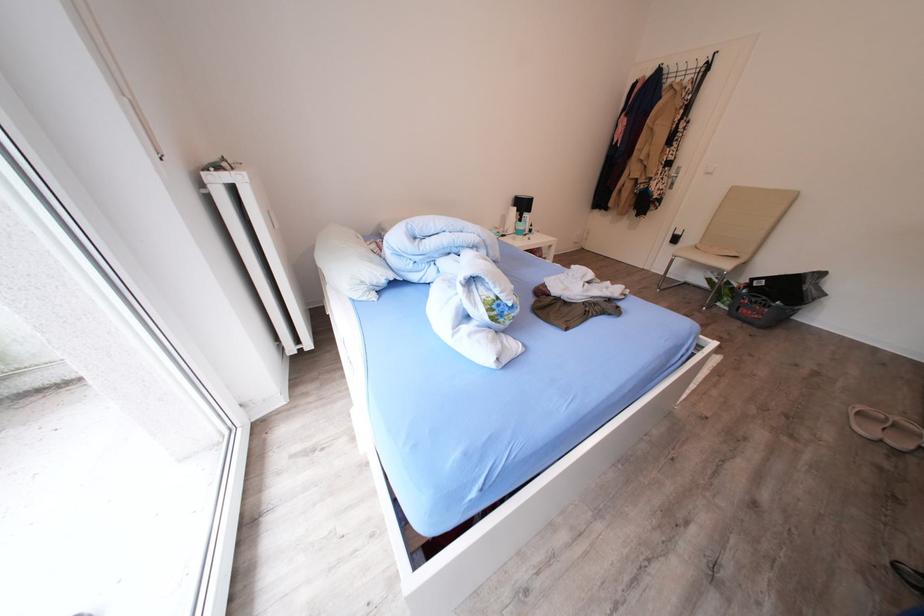
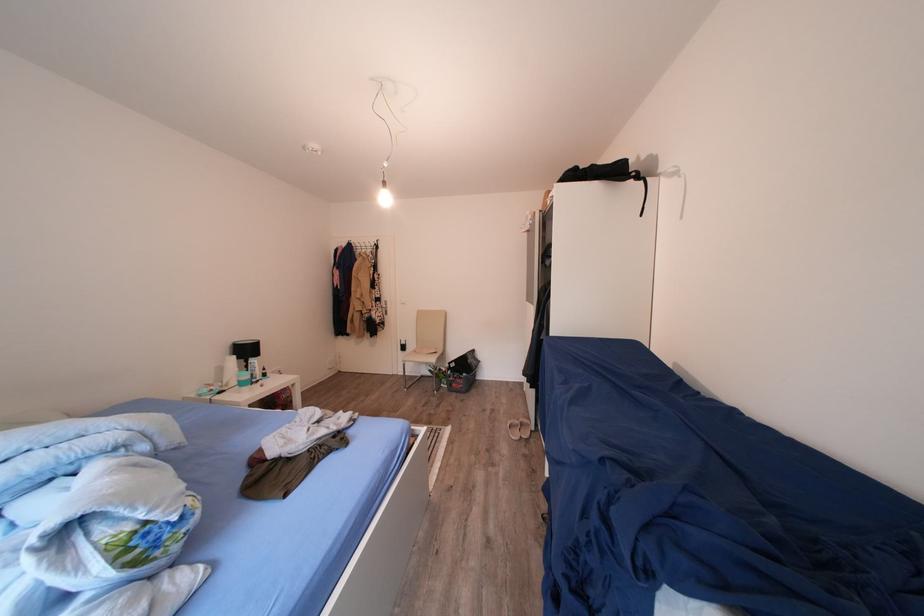
Find the pixel in the second image that matches point 529,225 in the first image.

(256, 371)